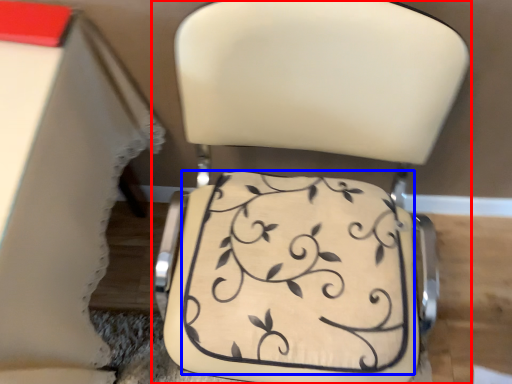
Question: Which object is closer to the camera taking this photo, chair (highlighted by a red box) or wedding cake (highlighted by a blue box)?

Choices:
 (A) chair
 (B) wedding cake

Answer: (A)